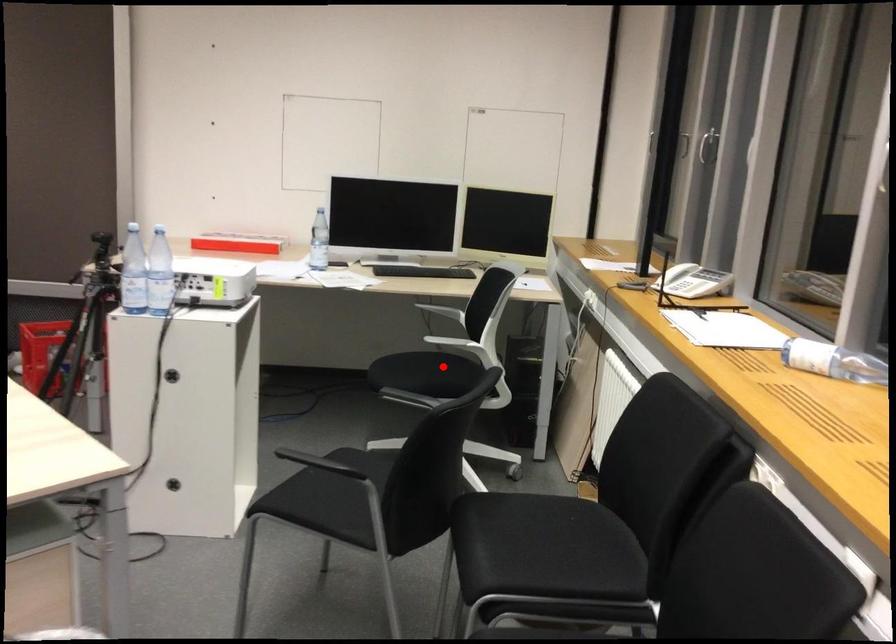
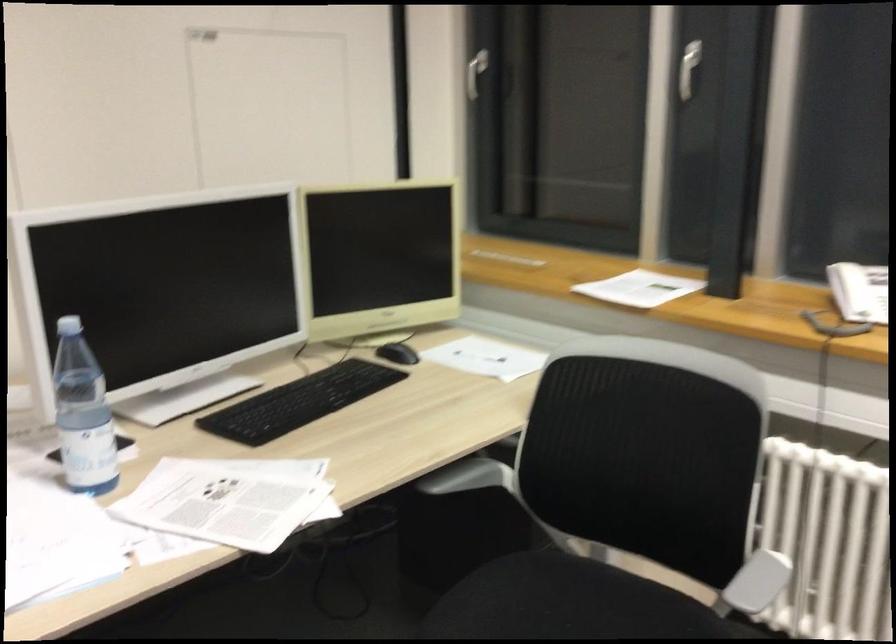
Question: I am providing you with two images of the same scene from different viewpoints. A red point is marked on the first image. Can you still see the location of the red point in image 2?

Choices:
 (A) Yes
 (B) No

Answer: (A)